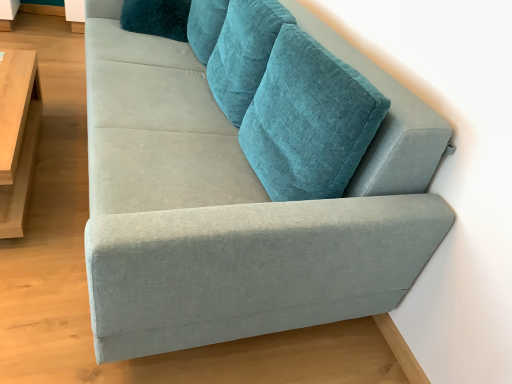
Question: In terms of height, does velvet teal couch at upper right look taller or shorter compared to light wood/wooden table at left?

Choices:
 (A) short
 (B) tall

Answer: (B)

Question: Considering the positions of velvet teal couch at upper right and light wood/wooden table at left in the image, is velvet teal couch at upper right wider or thinner than light wood/wooden table at left?

Choices:
 (A) wide
 (B) thin

Answer: (A)

Question: Which is nearer to the light wood/wooden table at left?

Choices:
 (A) velvet teal couch at upper right
 (B) teal velvet pillow at upper center

Answer: (B)

Question: Based on their relative distances, which object is farther from the velvet teal couch at upper right?

Choices:
 (A) teal velvet pillow at upper center
 (B) light wood/wooden table at left

Answer: (A)